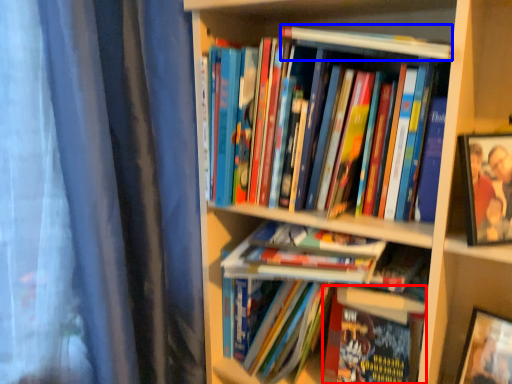
Question: Among these objects, which one is nearest to the camera, book (highlighted by a red box) or book (highlighted by a blue box)?

Choices:
 (A) book
 (B) book

Answer: (B)